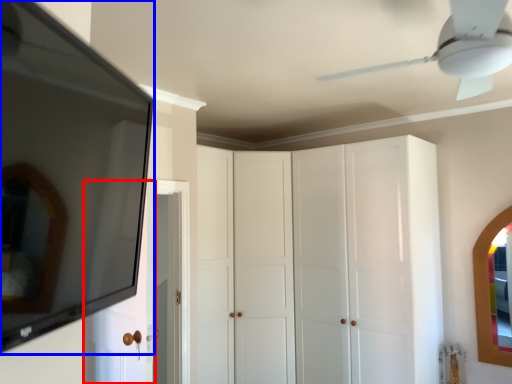
Question: Among these objects, which one is farthest to the camera, door (highlighted by a red box) or mirror (highlighted by a blue box)?

Choices:
 (A) door
 (B) mirror

Answer: (A)